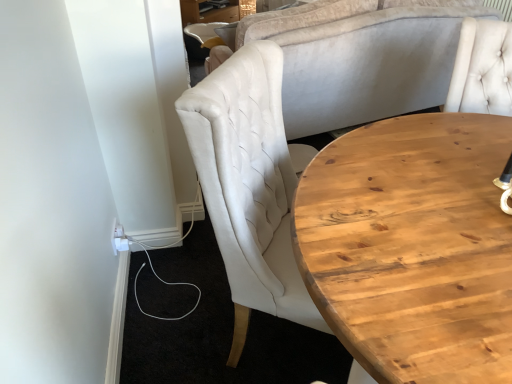
Question: In terms of width, does matte white chair at upper left look wider or thinner when compared to light brown wooden coffee table at right?

Choices:
 (A) wide
 (B) thin

Answer: (B)

Question: Visually, is matte white chair at upper left positioned to the left or to the right of light brown wooden coffee table at right?

Choices:
 (A) left
 (B) right

Answer: (A)

Question: From the image's perspective, is matte white chair at upper left above or below light brown wooden coffee table at right?

Choices:
 (A) below
 (B) above

Answer: (B)

Question: Considering the positions of point (473, 266) and point (183, 29), is point (473, 266) closer or farther from the camera than point (183, 29)?

Choices:
 (A) farther
 (B) closer

Answer: (B)

Question: Relative to matte white chair at upper left, is light brown wooden coffee table at right in front or behind?

Choices:
 (A) front
 (B) behind

Answer: (A)

Question: Considering the positions of light brown wooden coffee table at right and matte white chair at upper left in the image, is light brown wooden coffee table at right wider or thinner than matte white chair at upper left?

Choices:
 (A) thin
 (B) wide

Answer: (B)

Question: Considering the relative positions of light brown wooden coffee table at right and matte white chair at upper left in the image provided, is light brown wooden coffee table at right to the left or to the right of matte white chair at upper left?

Choices:
 (A) left
 (B) right

Answer: (B)